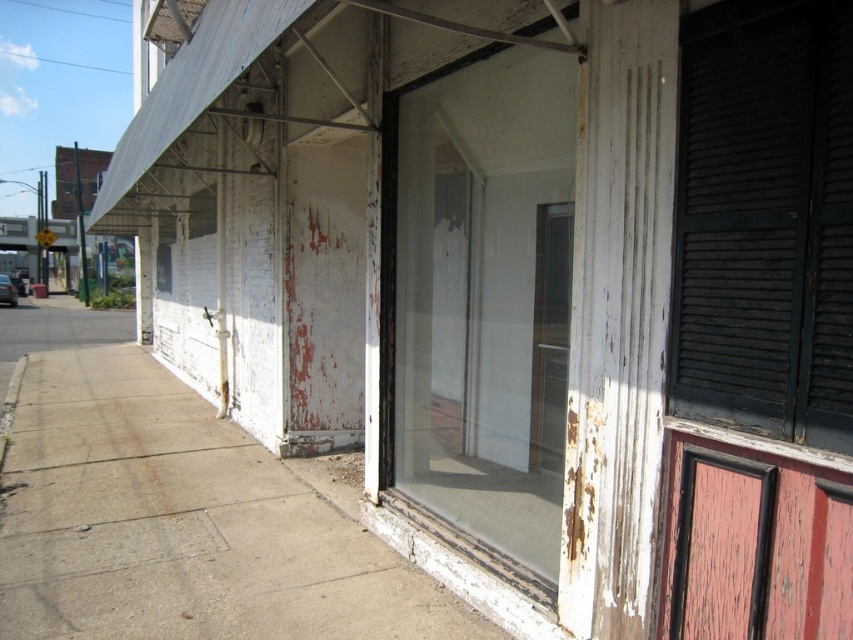
You are a delivery person trying to park your bike in front of the storefront. The dark gray wooden shutter at right is blocking your path. Can you move your bike to the concrete at center without moving the shutter?

The dark gray wooden shutter at right is behind concrete at center, so the concrete at center is in front of the shutter. Therefore, you can move your bike to the concrete at center without moving the shutter since it is not blocked by the shutter.

You are standing on the sidewalk in front of the abandoned storefront. You notice the concrete at center and the dark gray wooden shutter at right. Which object is positioned lower relative to the other?

The concrete at center is located below the dark gray wooden shutter at right, so it is positioned lower.

You are standing at a point 4.36 meters away from the camera. If you walk straight towards the camera, will you reach the point marked as point (318, 560) before reaching the storefront?

Yes, because the point marked as point (318, 560) is only 4.36 meters away from the camera, so walking straight towards the camera would reach it before reaching the storefront.